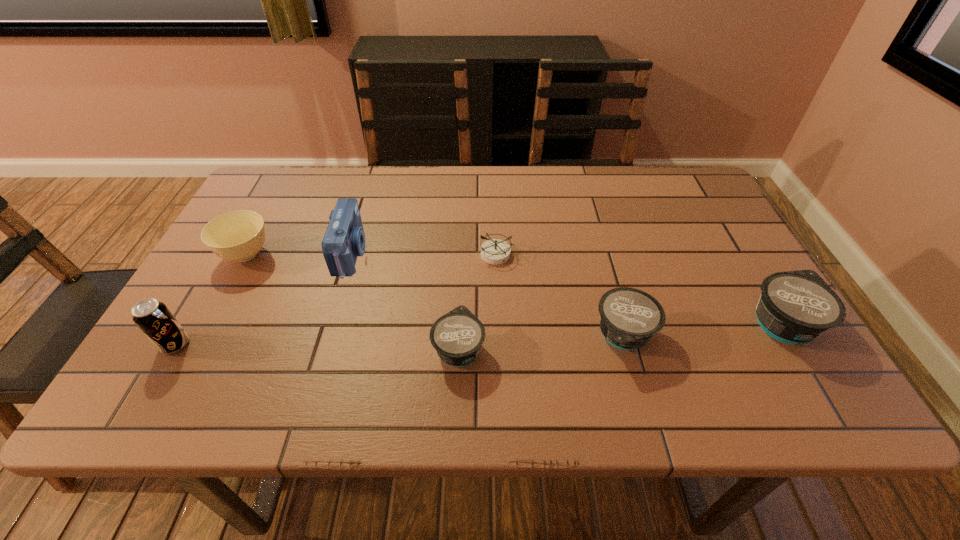
The width and height of the screenshot is (960, 540). In order to click on blank area in the image that satisfies the following two spatial constraints: 1. on the back side of the shortest object; 2. on the right side of the sugar bowl in this screenshot , I will do `click(247, 254)`.